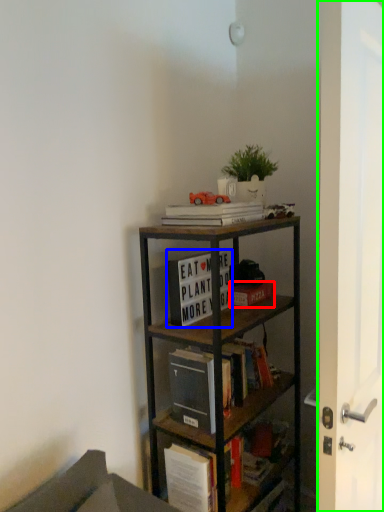
Question: Considering the real-world distances, which object is farthest from book (highlighted by a red box)? book (highlighted by a blue box) or glass door (highlighted by a green box)?

Choices:
 (A) book
 (B) glass door

Answer: (B)